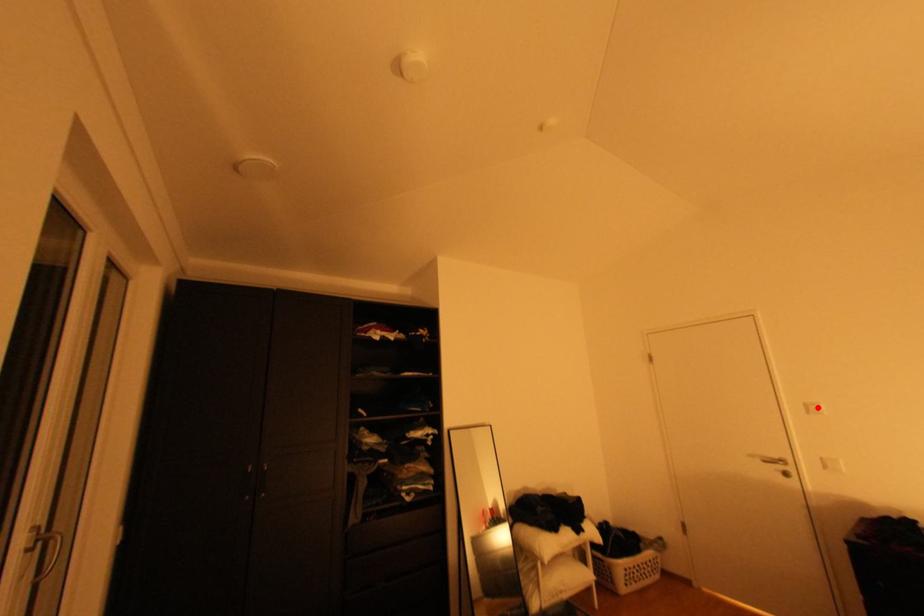
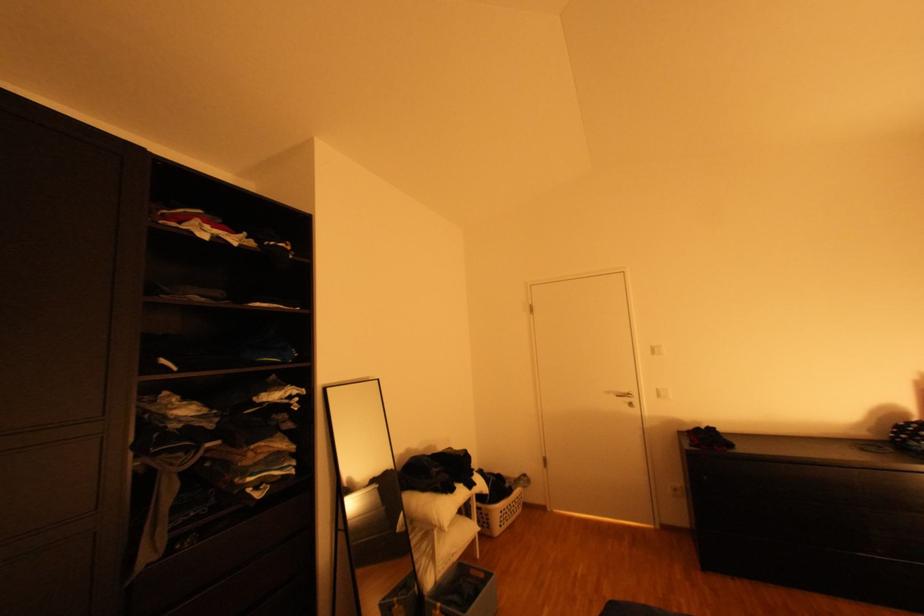
Find the pixel in the second image that matches the highlighted location in the first image.

(662, 349)